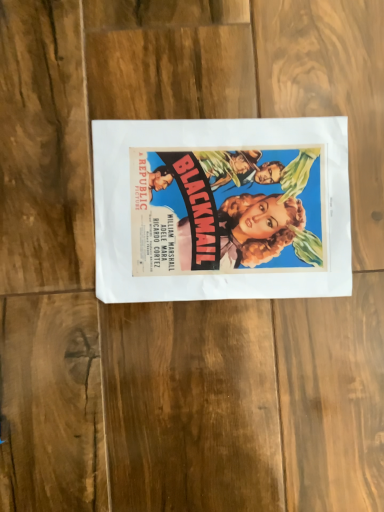
This screenshot has width=384, height=512. I want to click on matte paper poster at center, so click(x=221, y=209).

Describe the element at coordinates (221, 209) in the screenshot. I see `matte paper poster at center` at that location.

The height and width of the screenshot is (512, 384). Find the location of `matte paper poster at center`. matte paper poster at center is located at coordinates (221, 209).